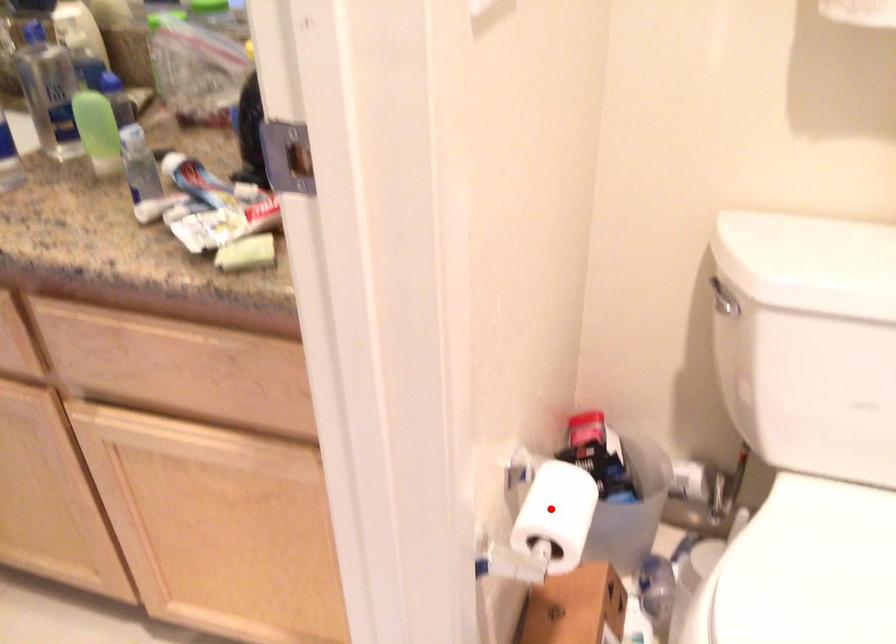
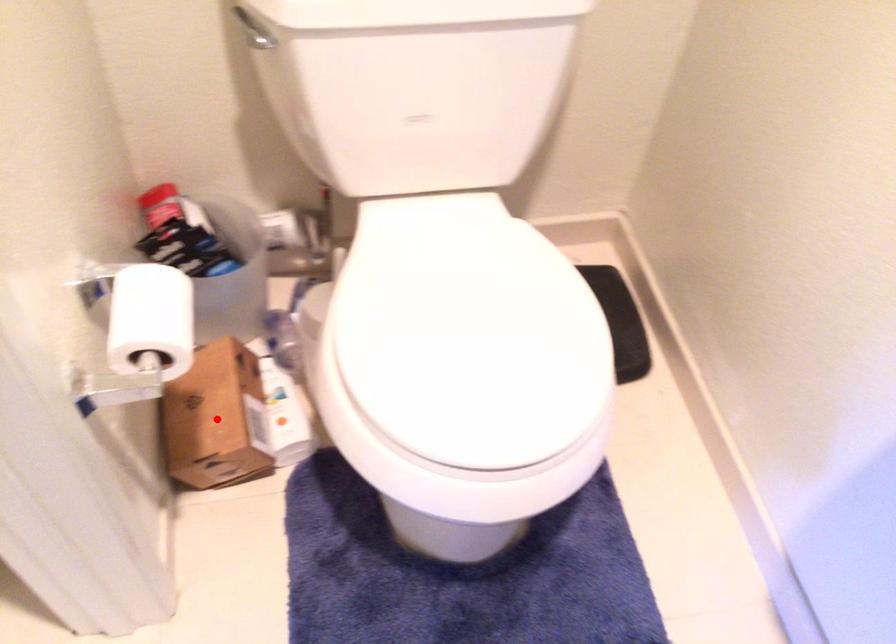
I am providing you with two images of the same scene from different viewpoints. A red point is marked on the first image and another point is marked on the second image. Is the marked point in image1 the same physical position as the marked point in image2?

No